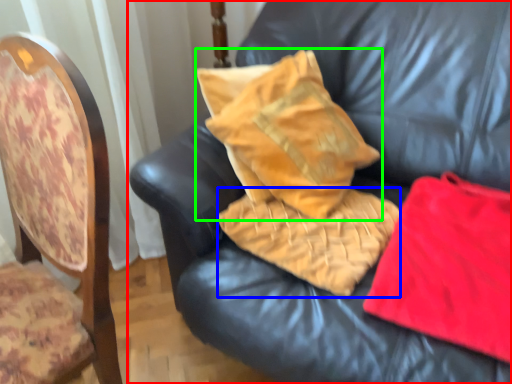
Question: Based on their relative distances, which object is nearer to furniture (highlighted by a red box)? Choose from material (highlighted by a blue box) and pillow (highlighted by a green box).

Choices:
 (A) material
 (B) pillow

Answer: (B)